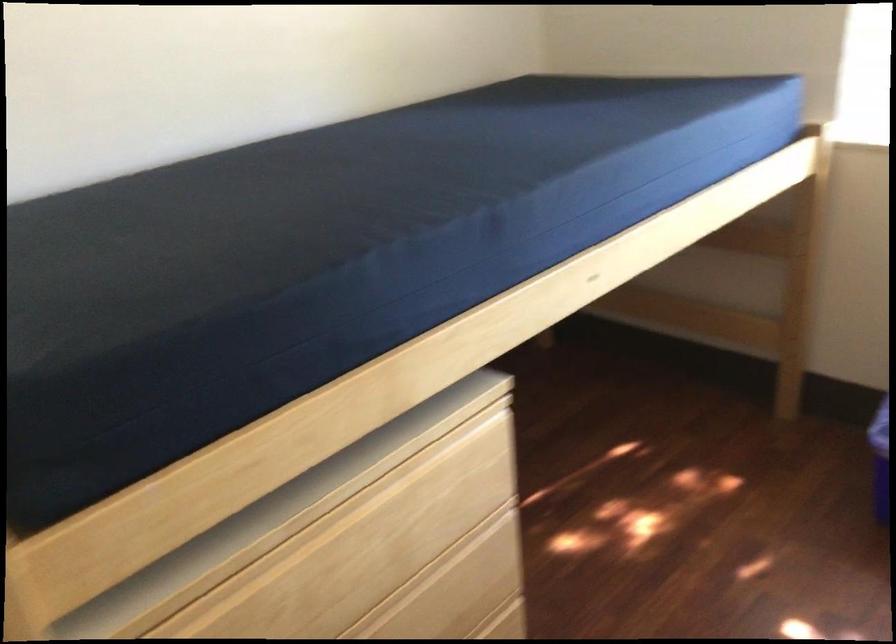
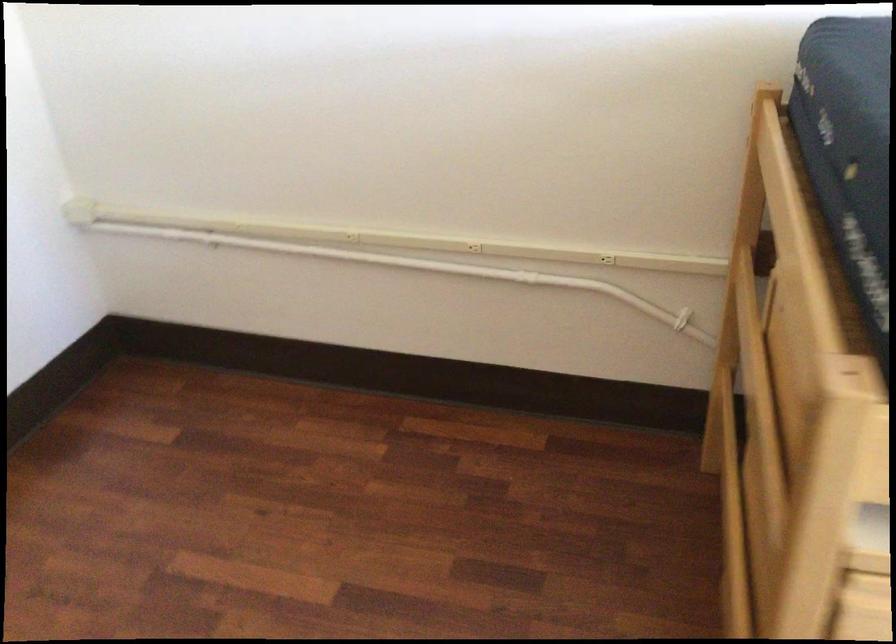
How did the camera likely rotate?

The rotation direction of the camera is left-down.